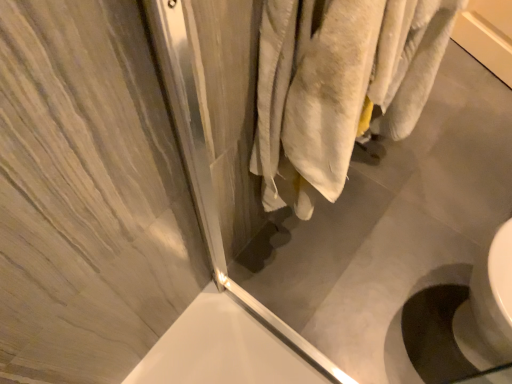
Question: Can you confirm if translucent glass screen door at upper right is smaller than white glossy sink at lower right?

Choices:
 (A) yes
 (B) no

Answer: (A)

Question: Does translucent glass screen door at upper right have a greater height compared to white glossy sink at lower right?

Choices:
 (A) yes
 (B) no

Answer: (A)

Question: From the image's perspective, would you say translucent glass screen door at upper right is positioned over white glossy sink at lower right?

Choices:
 (A) no
 (B) yes

Answer: (B)

Question: Are translucent glass screen door at upper right and white glossy sink at lower right far apart?

Choices:
 (A) yes
 (B) no

Answer: (B)

Question: Considering the relative positions of translucent glass screen door at upper right and white glossy sink at lower right in the image provided, is translucent glass screen door at upper right in front of white glossy sink at lower right?

Choices:
 (A) no
 (B) yes

Answer: (B)

Question: Does translucent glass screen door at upper right appear on the right side of white glossy sink at lower right?

Choices:
 (A) no
 (B) yes

Answer: (A)

Question: Is translucent glass screen door at upper right a part of white glossy sink at lower right?

Choices:
 (A) yes
 (B) no

Answer: (B)

Question: Considering the relative sizes of white glossy sink at lower right and translucent glass screen door at upper right in the image provided, is white glossy sink at lower right shorter than translucent glass screen door at upper right?

Choices:
 (A) yes
 (B) no

Answer: (A)

Question: Can you confirm if white glossy sink at lower right is smaller than translucent glass screen door at upper right?

Choices:
 (A) no
 (B) yes

Answer: (A)

Question: Is the depth of white glossy sink at lower right greater than that of translucent glass screen door at upper right?

Choices:
 (A) yes
 (B) no

Answer: (A)

Question: Can you confirm if white glossy sink at lower right is taller than translucent glass screen door at upper right?

Choices:
 (A) yes
 (B) no

Answer: (B)

Question: Is white glossy sink at lower right bigger than translucent glass screen door at upper right?

Choices:
 (A) yes
 (B) no

Answer: (A)

Question: Would you say translucent glass screen door at upper right is inside or outside white glossy sink at lower right?

Choices:
 (A) outside
 (B) inside

Answer: (A)